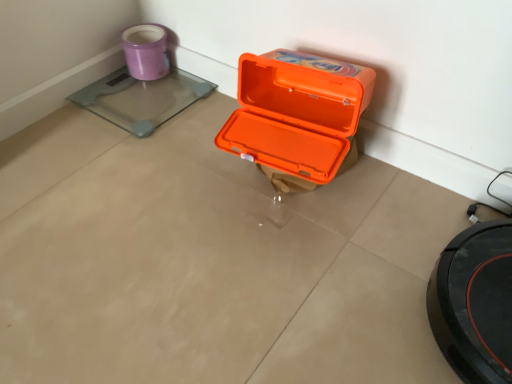
What are the coordinates of `free spot above transparent glass scale at upper left (from a real-world perspective)` in the screenshot? It's located at (142, 93).